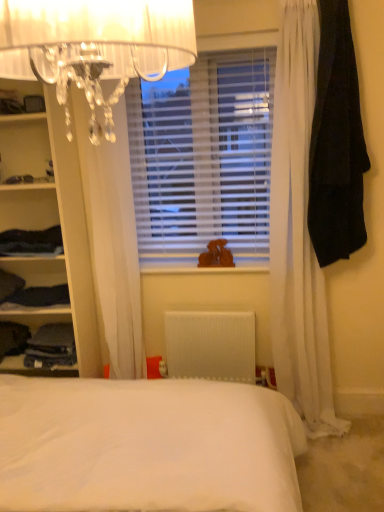
Question: From the image's perspective, is denim pants at left, which is the second clothing in left-to-right order, below matte white shelves at left?

Choices:
 (A) no
 (B) yes

Answer: (B)

Question: Considering the relative sizes of denim pants at left, which is the fifth clothing from right to left, and matte white shelves at left in the image provided, is denim pants at left, which is the fifth clothing from right to left, taller than matte white shelves at left?

Choices:
 (A) no
 (B) yes

Answer: (A)

Question: Can we say denim pants at left, which is the second clothing in left-to-right order, lies outside matte white shelves at left?

Choices:
 (A) no
 (B) yes

Answer: (A)

Question: Is matte white shelves at left inside denim pants at left, which is the fifth clothing from right to left?

Choices:
 (A) yes
 (B) no

Answer: (B)

Question: Considering the relative sizes of denim pants at left, which is the second clothing in left-to-right order, and matte white shelves at left in the image provided, is denim pants at left, which is the second clothing in left-to-right order, wider than matte white shelves at left?

Choices:
 (A) yes
 (B) no

Answer: (B)

Question: Is matte white shelves at left at the back of denim pants at left, which is the second clothing in left-to-right order?

Choices:
 (A) no
 (B) yes

Answer: (B)

Question: Can you confirm if translucent crystal chandelier at upper left is thinner than dark blue fabric at left, positioned as the first clothing in left-to-right order?

Choices:
 (A) yes
 (B) no

Answer: (A)

Question: Is translucent crystal chandelier at upper left smaller than dark blue fabric at left, positioned as the first clothing in left-to-right order?

Choices:
 (A) yes
 (B) no

Answer: (B)

Question: Considering the relative positions of translucent crystal chandelier at upper left and dark blue fabric at left, which is counted as the 6th clothing, starting from the right, in the image provided, is translucent crystal chandelier at upper left to the right of dark blue fabric at left, which is counted as the 6th clothing, starting from the right, from the viewer's perspective?

Choices:
 (A) yes
 (B) no

Answer: (A)

Question: Is translucent crystal chandelier at upper left positioned before dark blue fabric at left, positioned as the first clothing in left-to-right order?

Choices:
 (A) yes
 (B) no

Answer: (A)

Question: Is translucent crystal chandelier at upper left to the left of dark blue fabric at left, positioned as the first clothing in left-to-right order, from the viewer's perspective?

Choices:
 (A) no
 (B) yes

Answer: (A)

Question: From a real-world perspective, is translucent crystal chandelier at upper left positioned over dark blue fabric at left, positioned as the first clothing in left-to-right order, based on gravity?

Choices:
 (A) no
 (B) yes

Answer: (B)

Question: Is dark blue fabric at left, the second clothing viewed from the right, at the left side of white plastic radiator at center?

Choices:
 (A) yes
 (B) no

Answer: (A)